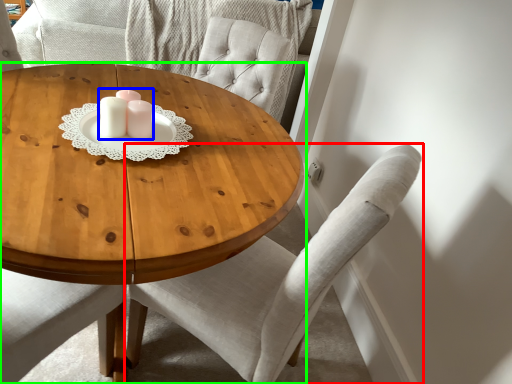
Question: Estimate the real-world distances between objects in this image. Which object is farther from chair (highlighted by a red box), candle holder (highlighted by a blue box) or coffee table (highlighted by a green box)?

Choices:
 (A) candle holder
 (B) coffee table

Answer: (A)